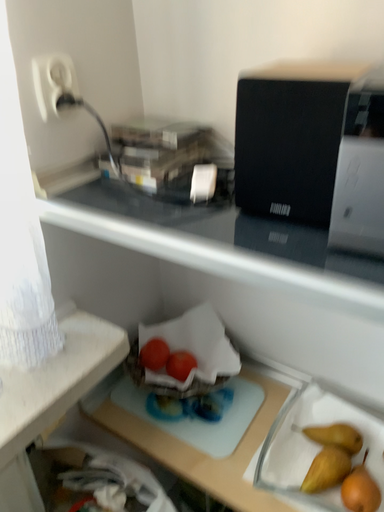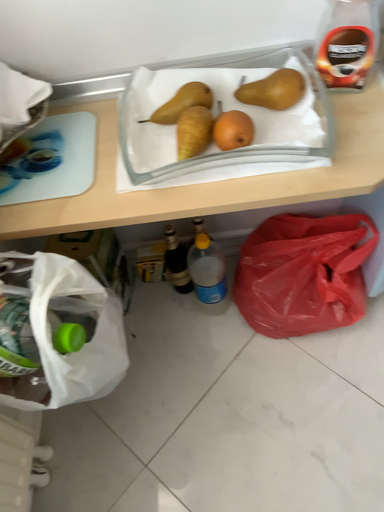
Question: Which way did the camera rotate in the video?

Choices:
 (A) rotated upward
 (B) rotated downward

Answer: (B)